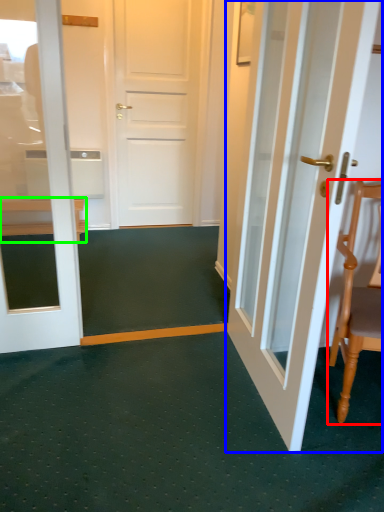
Question: Which object is positioned closest to chair (highlighted by a red box)? Select from door (highlighted by a blue box) and furniture (highlighted by a green box).

Choices:
 (A) door
 (B) furniture

Answer: (A)